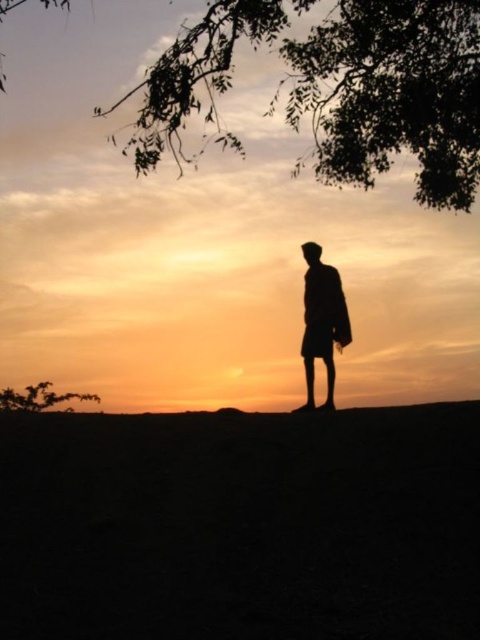
Question: Which of the following is the closest to the observer?

Choices:
 (A) matte black person at center
 (B) silhouette leafy branch at upper center

Answer: (A)

Question: Is matte black person at center positioned behind green leafy tree at lower left?

Choices:
 (A) no
 (B) yes

Answer: (A)

Question: Which point is farther to the camera?

Choices:
 (A) (151, 97)
 (B) (66, 394)
 (C) (300, 598)
 (D) (323, 323)

Answer: (B)

Question: Considering the relative positions of dark soil hill at center and green leafy tree at lower left in the image provided, where is dark soil hill at center located with respect to green leafy tree at lower left?

Choices:
 (A) right
 (B) left

Answer: (A)

Question: Which point appears closest to the camera in this image?

Choices:
 (A) (92, 536)
 (B) (158, 157)
 (C) (304, 314)

Answer: (A)

Question: Does silhouette leafy branch at upper center have a lesser width compared to matte black person at center?

Choices:
 (A) no
 (B) yes

Answer: (B)